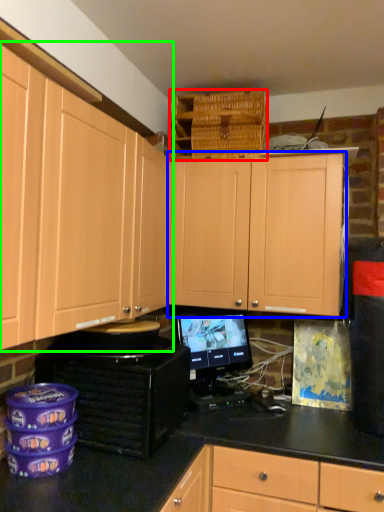
Question: Which object is the closest to the basket (highlighted by a red box)? Choose among these: cabinetry (highlighted by a blue box) or cabinetry (highlighted by a green box).

Choices:
 (A) cabinetry
 (B) cabinetry

Answer: (A)